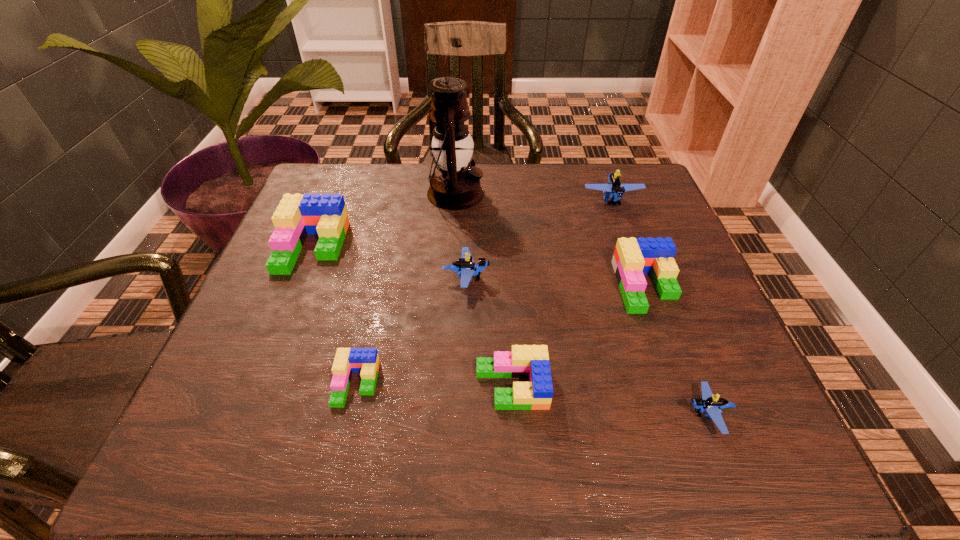
I want to click on the tallest object, so click(x=455, y=185).

The height and width of the screenshot is (540, 960). I want to click on brown lantern, so click(455, 185).

You are a GUI agent. You are given a task and a screenshot of the screen. Output one action in this format:
    pyautogui.click(x=<x>, y=<y>)
    Task: Click on the farthest Lego
    
    Given the screenshot: What is the action you would take?
    pyautogui.click(x=614, y=189)

Locate an element on the screen. the biggest blue Lego is located at coordinates (614, 189).

Where is `the leftmost object`? The width and height of the screenshot is (960, 540). the leftmost object is located at coordinates (296, 216).

Identify the location of the leftmost Lego. The image size is (960, 540). 296,216.

Find the location of a particular element. the second farthest blue Lego is located at coordinates (465, 267).

Identify the location of the second biggest blue Lego. This screenshot has height=540, width=960. pos(465,267).

The height and width of the screenshot is (540, 960). In order to click on the rightmost green Lego in this screenshot , I will do `click(633, 257)`.

The image size is (960, 540). What are the coordinates of `the second smallest green Lego` in the screenshot? It's located at (523, 361).